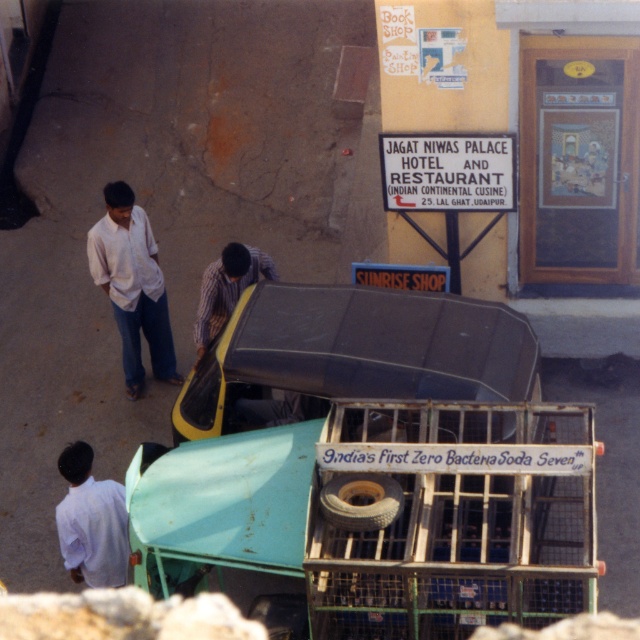
In the scene shown: Between yellow matte car at center and striped fabric shirt at center, which one is positioned lower?

yellow matte car at center is below.

Between yellow matte car at center and striped fabric shirt at center, which one appears on the left side from the viewer's perspective?

From the viewer's perspective, striped fabric shirt at center appears more on the left side.

Who is more distant from viewer, (460,396) or (230,282)?

The point (230,282) is behind.

Image resolution: width=640 pixels, height=640 pixels. I want to click on yellow matte car at center, so click(x=356, y=352).

Is white cotton shirt at left wider than brown rubber tire at center?

Yes, white cotton shirt at left is wider than brown rubber tire at center.

Does point (116, 198) lie in front of point (387, 477)?

No, it is behind (387, 477).

Find the location of `white cotton shirt at left`. white cotton shirt at left is located at coordinates (132, 285).

Can you confirm if yellow matte car at center is positioned to the right of white cotton shirt at lower left?

Indeed, yellow matte car at center is positioned on the right side of white cotton shirt at lower left.

Is point (198, 368) positioned behind point (68, 563)?

That is True.

In order to click on yellow matte car at center in this screenshot , I will do `click(356, 352)`.